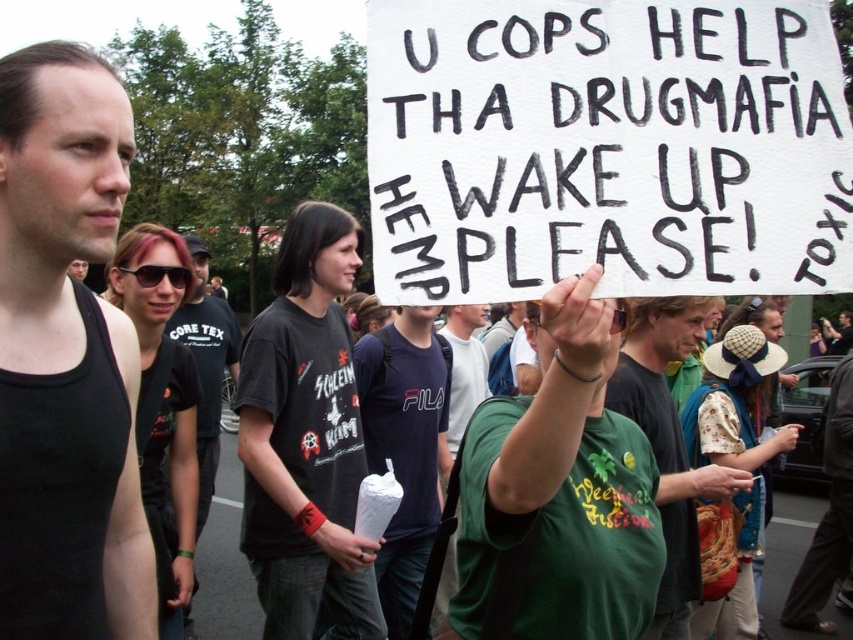
Can you confirm if black tank top at left is positioned to the right of green fabric shirt at center?

No, black tank top at left is not to the right of green fabric shirt at center.

Which of these two, black tank top at left or green fabric shirt at center, stands taller?

black tank top at left is taller.

Describe the element at coordinates (67, 358) in the screenshot. This screenshot has width=853, height=640. I see `black tank top at left` at that location.

This screenshot has height=640, width=853. What are the coordinates of `black tank top at left` in the screenshot? It's located at (67, 358).

Is point (103, 513) in front of point (196, 355)?

Yes, it is.

Between black tank top at left and black cotton t-shirt at center, which one appears on the right side from the viewer's perspective?

From the viewer's perspective, black tank top at left appears more on the right side.

What do you see at coordinates (67, 358) in the screenshot? I see `black tank top at left` at bounding box center [67, 358].

Find the location of `black tank top at left`. black tank top at left is located at coordinates (67, 358).

Who is taller, green fabric shirt at center or black cotton t-shirt at center?

With more height is black cotton t-shirt at center.

Locate an element on the screen. green fabric shirt at center is located at coordinates pyautogui.click(x=669, y=442).

Image resolution: width=853 pixels, height=640 pixels. What do you see at coordinates (669, 442) in the screenshot? I see `green fabric shirt at center` at bounding box center [669, 442].

Identify the location of green fabric shirt at center. The height and width of the screenshot is (640, 853). (669, 442).